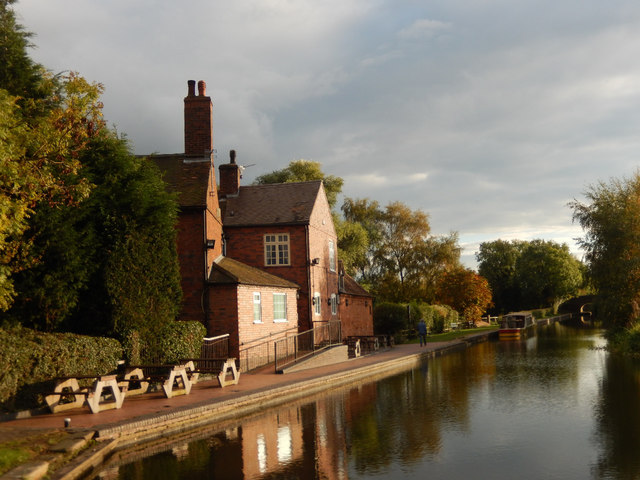
At what (x,y) coordinates should I click in order to perform the action: click on window. Please return your answer as a coordinate pair (x, y). This screenshot has width=640, height=480. Looking at the image, I should click on (255, 309), (282, 306), (275, 252), (319, 303), (335, 304), (329, 255).